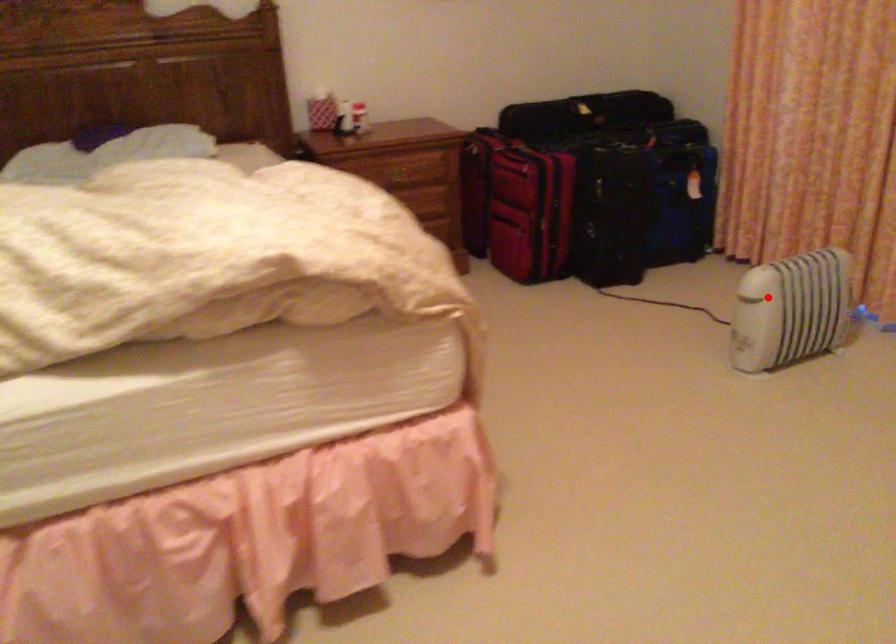
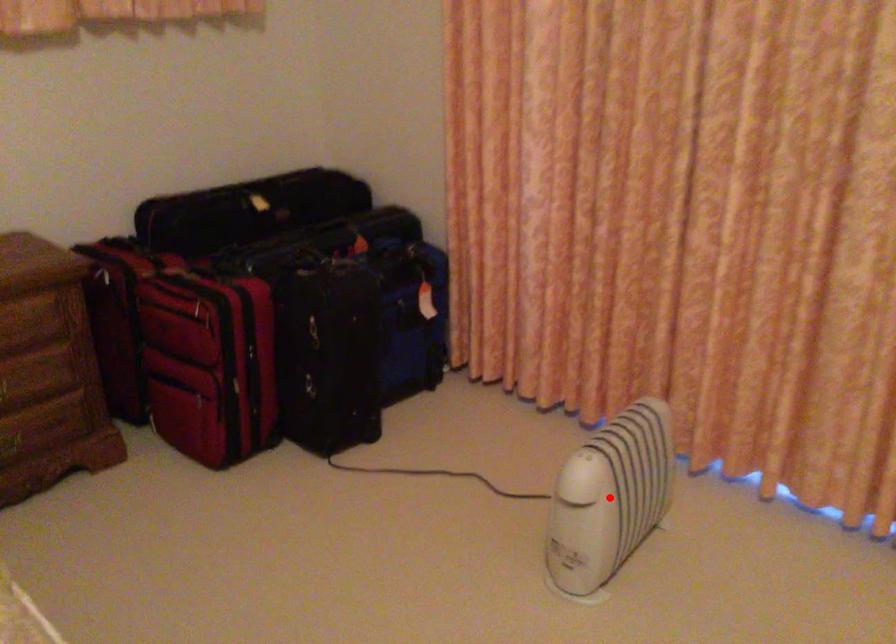
I am providing you with two images of the same scene from different viewpoints. A red point is marked on the first image and another point is marked on the second image. Are the points marked in image1 and image2 representing the same 3D position?

Yes